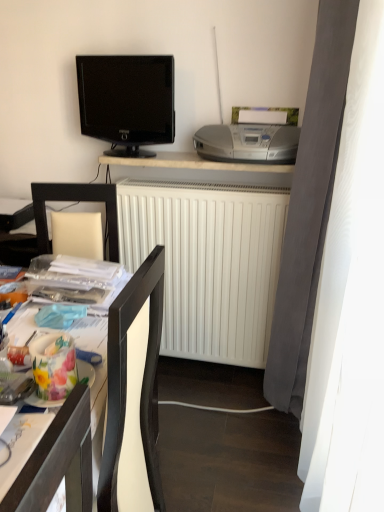
Question: Is white matte radiator at center smaller than white matte desk at upper center, the 1th desk positioned from the back?

Choices:
 (A) no
 (B) yes

Answer: (A)

Question: From the image's perspective, does white matte radiator at center appear higher than white matte desk at upper center, the 1th desk positioned from the back?

Choices:
 (A) no
 (B) yes

Answer: (A)

Question: From a real-world perspective, is white matte radiator at center below white matte desk at upper center, the first desk when ordered from top to bottom?

Choices:
 (A) no
 (B) yes

Answer: (B)

Question: Considering the relative sizes of white matte radiator at center and white matte desk at upper center, the first desk when ordered from top to bottom, in the image provided, is white matte radiator at center thinner than white matte desk at upper center, the first desk when ordered from top to bottom,?

Choices:
 (A) no
 (B) yes

Answer: (A)

Question: From a real-world perspective, is white matte radiator at center positioned over white matte desk at upper center, which is counted as the 2th desk, starting from the bottom, based on gravity?

Choices:
 (A) yes
 (B) no

Answer: (B)

Question: From the image's perspective, does white matte radiator at center appear lower than white matte desk at upper center, the first desk when ordered from top to bottom?

Choices:
 (A) yes
 (B) no

Answer: (A)

Question: Does silver metallic stereo at upper right turn towards white matte radiator at center?

Choices:
 (A) yes
 (B) no

Answer: (B)

Question: Can you confirm if silver metallic stereo at upper right is shorter than white matte radiator at center?

Choices:
 (A) yes
 (B) no

Answer: (A)

Question: Is silver metallic stereo at upper right thinner than white matte radiator at center?

Choices:
 (A) no
 (B) yes

Answer: (A)

Question: From a real-world perspective, is silver metallic stereo at upper right over white matte radiator at center?

Choices:
 (A) yes
 (B) no

Answer: (A)

Question: From the image's perspective, is silver metallic stereo at upper right on white matte radiator at center?

Choices:
 (A) yes
 (B) no

Answer: (A)

Question: From the image's perspective, would you say silver metallic stereo at upper right is shown under white matte radiator at center?

Choices:
 (A) no
 (B) yes

Answer: (A)

Question: Does white matte radiator at center touch silver metallic stereo at upper right?

Choices:
 (A) no
 (B) yes

Answer: (A)